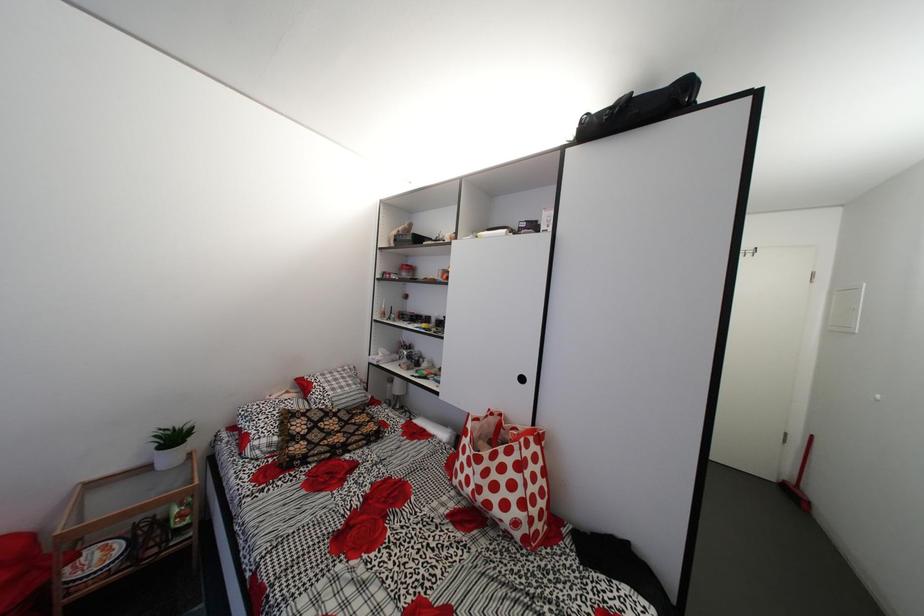
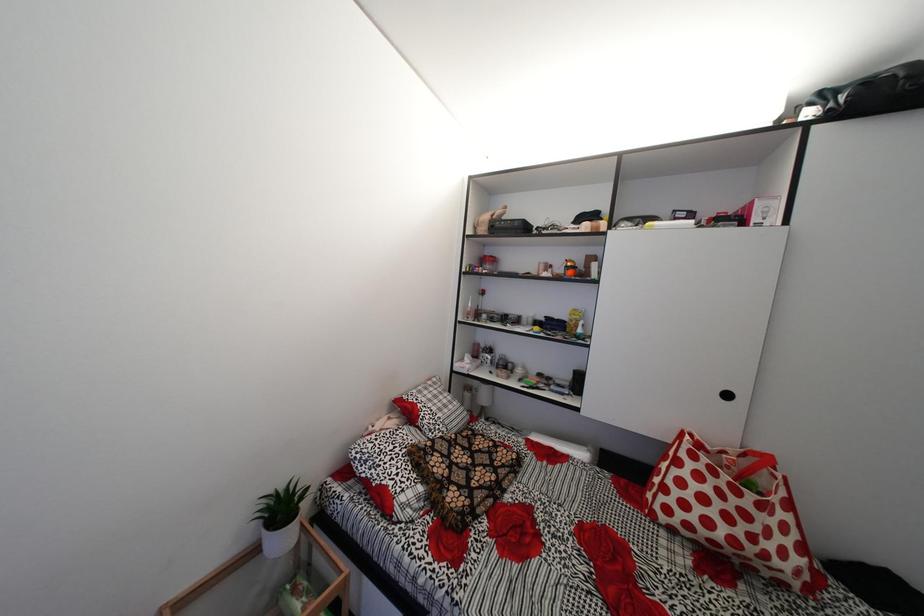
The images are taken continuously from a first-person perspective. In which direction are you moving?

The movement direction of the cameraman is left, forward.